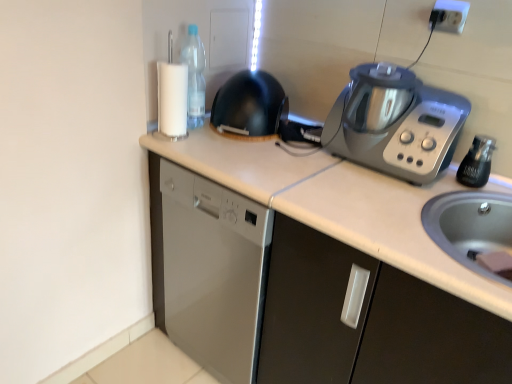
Find the location of a particular element. The width and height of the screenshot is (512, 384). vacant area that is situated to the right of black glass bottle at right, which is the 1th bottle from bottom to top is located at coordinates (495, 186).